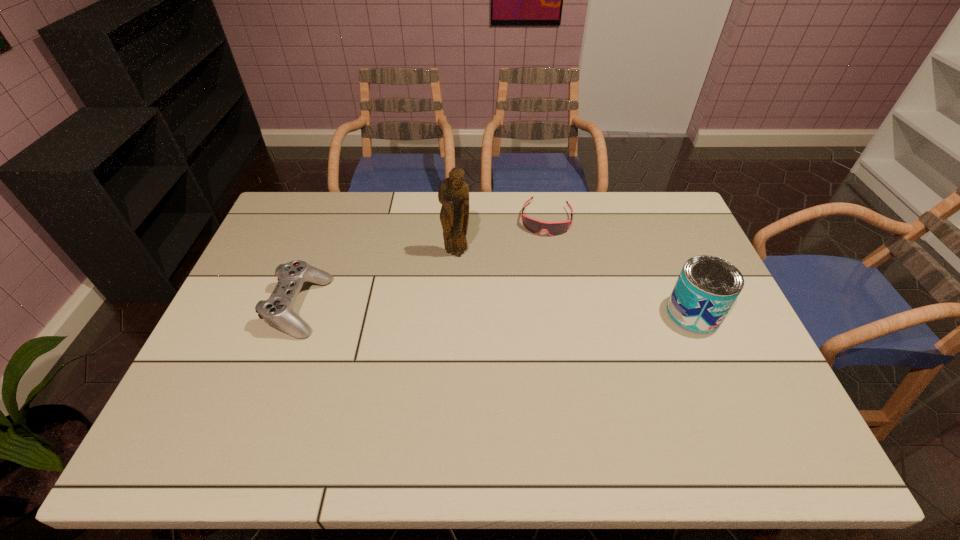
I want to click on free spot between the second shortest object and the can, so click(496, 310).

What are the coordinates of `free space between the second object from left to right and the second shortest object` in the screenshot? It's located at (377, 280).

You are a GUI agent. You are given a task and a screenshot of the screen. Output one action in this format:
    pyautogui.click(x=<x>, y=<y>)
    Task: Click on the free point between the rightmost object and the leftmost object
    The width and height of the screenshot is (960, 540).
    Given the screenshot: What is the action you would take?
    pyautogui.click(x=496, y=310)

Identify the location of free area in between the farthest object and the second tallest object. (620, 266).

You are a GUI agent. You are given a task and a screenshot of the screen. Output one action in this format:
    pyautogui.click(x=<x>, y=<y>)
    Task: Click on the free spot between the third object from right to left and the shortest object
    The image size is (960, 540).
    Given the screenshot: What is the action you would take?
    pyautogui.click(x=501, y=237)

Find the location of a particular element. This screenshot has height=540, width=960. empty space that is in between the third object from right to left and the rightmost object is located at coordinates (575, 284).

Identify which object is located as the nearest to the shortest object. Please provide its 2D coordinates. Your answer should be formatted as a tuple, i.e. [(x, y)], where the tuple contains the x and y coordinates of a point satisfying the conditions above.

[(453, 193)]

The height and width of the screenshot is (540, 960). What are the coordinates of `the closest object relative to the leftmost object` in the screenshot? It's located at (453, 193).

Where is `free space that satisfies the following two spatial constraints: 1. on the back side of the second object from right to left; 2. on the left side of the third nearest object`? The width and height of the screenshot is (960, 540). free space that satisfies the following two spatial constraints: 1. on the back side of the second object from right to left; 2. on the left side of the third nearest object is located at coordinates (459, 219).

At what (x,y) coordinates should I click in order to perform the action: click on free region that satisfies the following two spatial constraints: 1. on the front side of the can; 2. on the right side of the second object from right to left. Please return your answer as a coordinate pair (x, y). This screenshot has height=540, width=960. Looking at the image, I should click on (562, 313).